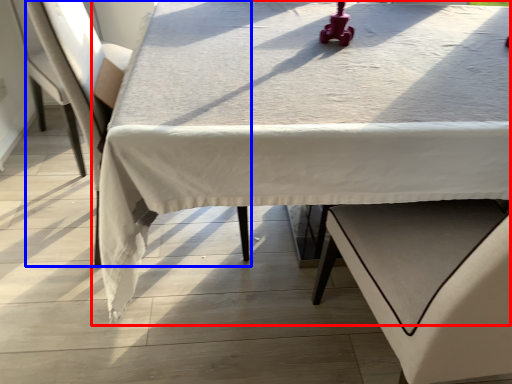
Question: Which object appears closest to the camera in this image, table (highlighted by a red box) or armchair (highlighted by a blue box)?

Choices:
 (A) table
 (B) armchair

Answer: (A)